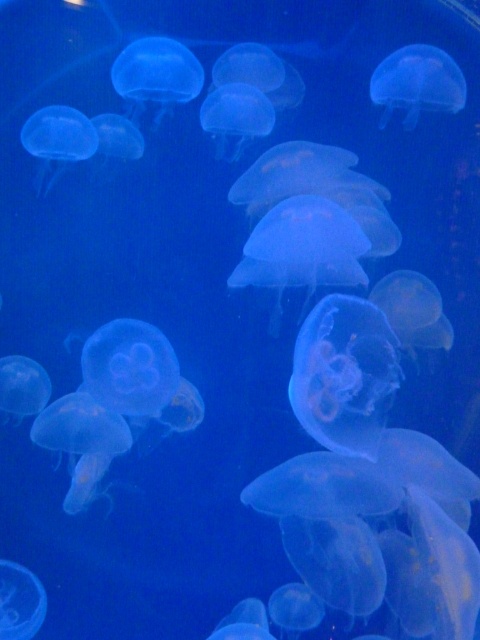
Measure the distance between point (x=344, y=413) and camera.

They are 3.65 feet apart.

Which is more to the right, translucent gelatinous at center or translucent gelatinous at lower left?

translucent gelatinous at center

At what (x,y) coordinates should I click in order to perform the action: click on translucent gelatinous at center. Please return your answer as a coordinate pair (x, y). Looking at the image, I should click on (345, 374).

Where is `translucent gelatinous at center`? This screenshot has width=480, height=640. translucent gelatinous at center is located at coordinates (345, 374).

Between translucent blue jellyfish at center and translucent blue jellyfish at upper right, which one is positioned higher?

Positioned higher is translucent blue jellyfish at upper right.

Is point (156, 374) farther from camera compared to point (447, 106)?

No, (156, 374) is in front of (447, 106).

The height and width of the screenshot is (640, 480). I want to click on translucent blue jellyfish at center, so click(x=130, y=368).

Can you confirm if translucent blue jellyfish at upper right is shorter than translucent gelatinous at lower left?

No, translucent blue jellyfish at upper right is not shorter than translucent gelatinous at lower left.

Does translucent blue jellyfish at upper right come in front of translucent gelatinous at lower left?

No, it is not.

Where is `translucent blue jellyfish at upper right`? The width and height of the screenshot is (480, 640). translucent blue jellyfish at upper right is located at coordinates (417, 83).

I want to click on translucent blue jellyfish at upper right, so click(x=417, y=83).